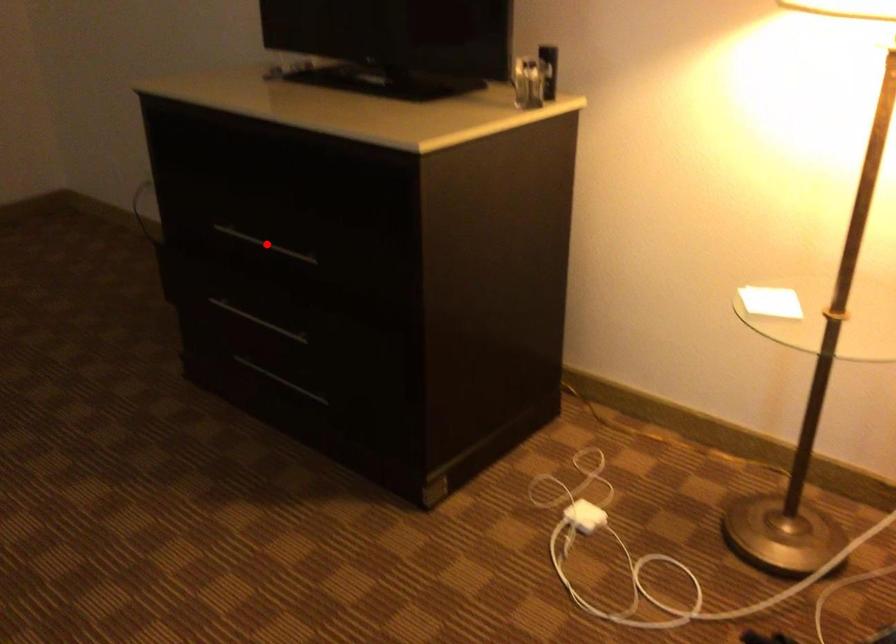
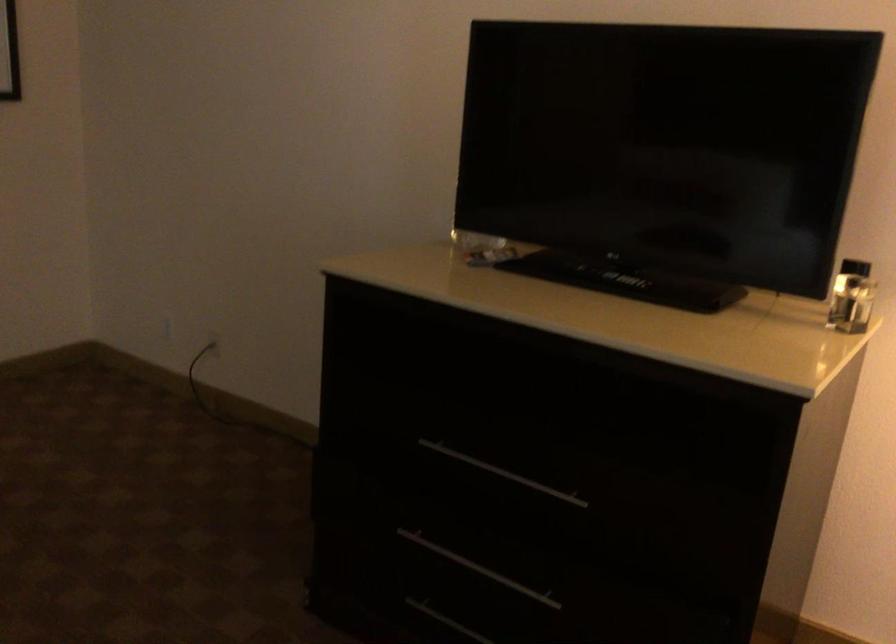
In the second image, find the point that corresponds to the highlighted location in the first image.

(502, 473)